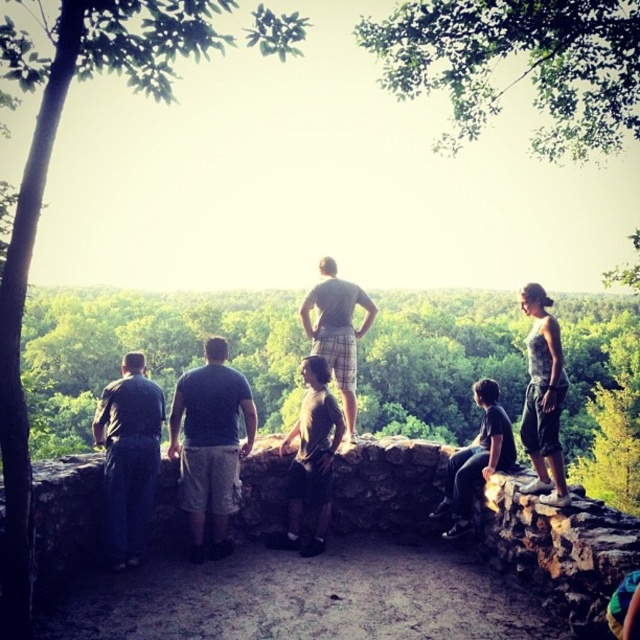
Question: Where is dark blue jeans at left located in relation to printed cotton tank top at right in the image?

Choices:
 (A) below
 (B) above

Answer: (B)

Question: Which object is closer to the camera taking this photo?

Choices:
 (A) dark gray cotton shirt at center
 (B) printed cotton tank top at right
 (C) dark blue jeans at left
 (D) dark gray shirt at lower right

Answer: (B)

Question: Is plaid shorts at center closer to camera compared to dark gray shirt at lower right?

Choices:
 (A) yes
 (B) no

Answer: (B)

Question: Estimate the real-world distances between objects in this image. Which object is closer to the dark blue jeans at left?

Choices:
 (A) plaid shorts at center
 (B) dark gray cotton shirt at center

Answer: (B)

Question: Does plaid shorts at center appear on the right side of dark gray shirt at lower right?

Choices:
 (A) yes
 (B) no

Answer: (B)

Question: Which point is closer to the camera?

Choices:
 (A) dark gray shirt at lower right
 (B) plaid shorts at center
 (C) printed cotton tank top at right

Answer: (C)